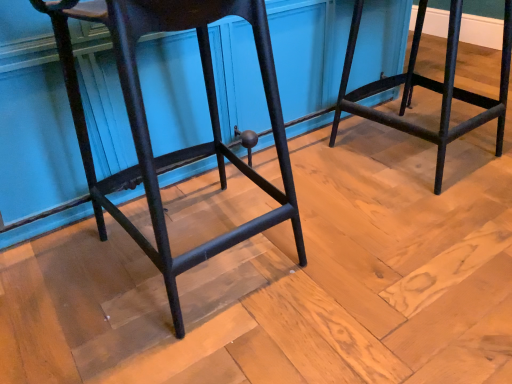
Locate an element on the screen. vacant area situated to the left side of matte black stool at center, the 2th furniture from the right is located at coordinates (59, 282).